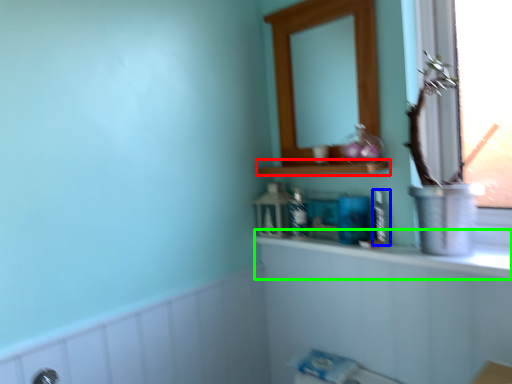
Question: Estimate the real-world distances between objects in this image. Which object is closer to shelf (highlighted by a red box), toiletry (highlighted by a blue box) or counter top (highlighted by a green box)?

Choices:
 (A) toiletry
 (B) counter top

Answer: (A)